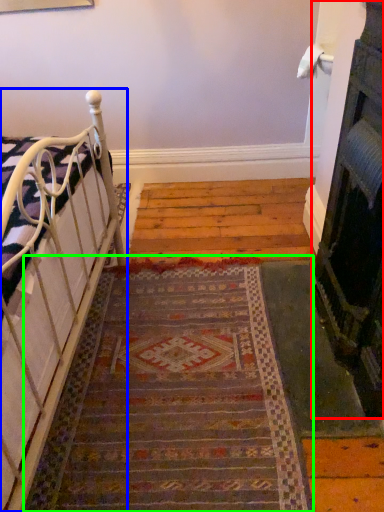
Question: Which is nearer to the fireplace (highlighted by a red box)? furniture (highlighted by a blue box) or doormat (highlighted by a green box).

Choices:
 (A) furniture
 (B) doormat

Answer: (B)